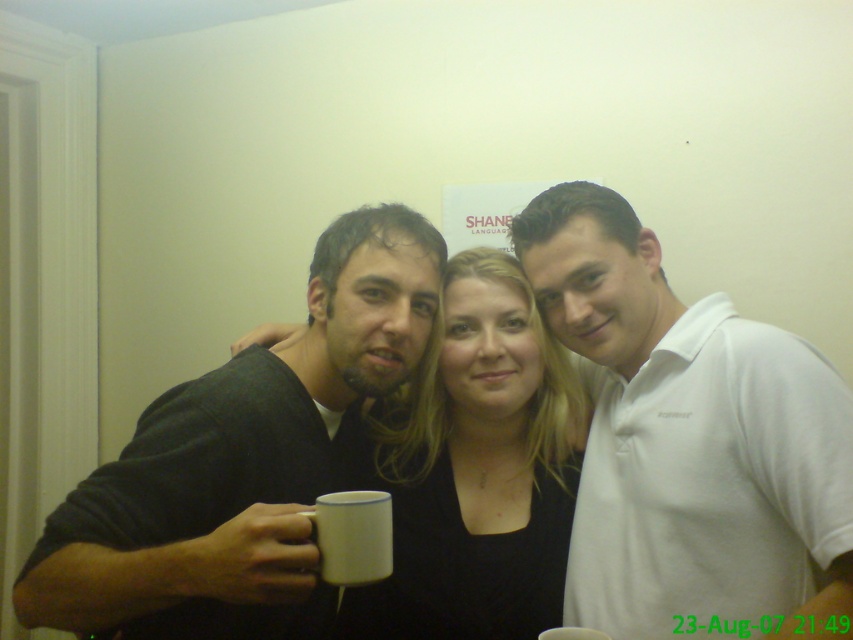
Question: Based on their relative distances, which object is farther from the white ceramic mug at center?

Choices:
 (A) white enamel mug at lower left
 (B) white cotton polo shirt at center
 (C) white matte mug at center

Answer: (C)

Question: Can you confirm if matte black shirt at center is wider than white matte mug at center?

Choices:
 (A) no
 (B) yes

Answer: (B)

Question: Which object is the closest to the white enamel mug at lower left?

Choices:
 (A) white matte mug at center
 (B) white ceramic mug at center
 (C) white cotton polo shirt at center

Answer: (B)

Question: Which object is the closest to the white ceramic mug at center?

Choices:
 (A) black matte shirt at center
 (B) white cotton polo shirt at center
 (C) white enamel mug at lower left
 (D) white matte mug at center

Answer: (C)

Question: Can you confirm if black matte shirt at center is wider than white ceramic mug at center?

Choices:
 (A) no
 (B) yes

Answer: (B)

Question: Is matte black shirt at center above white ceramic mug at center?

Choices:
 (A) no
 (B) yes

Answer: (B)